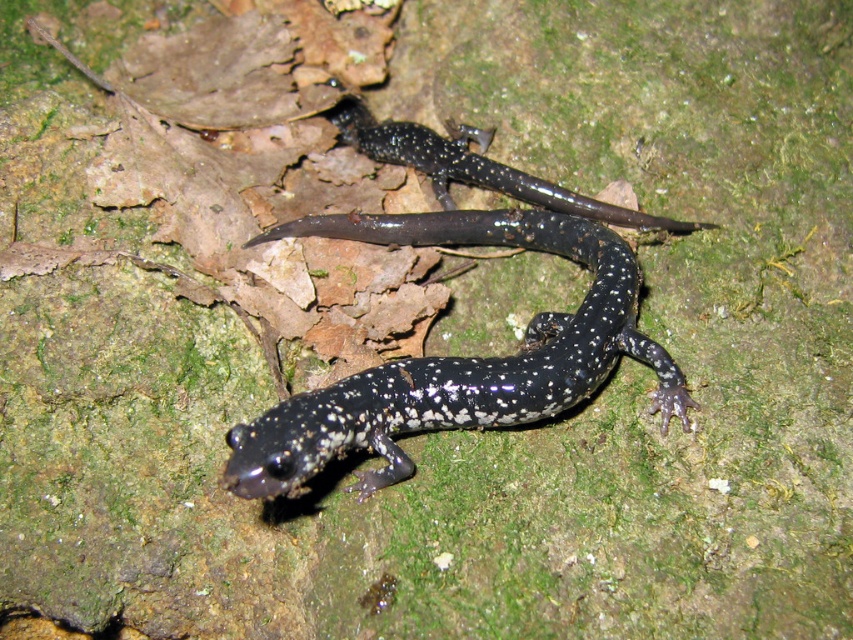
Question: Is shiny black salamander at center behind speckled glossy salamander at center?

Choices:
 (A) yes
 (B) no

Answer: (B)

Question: Can you confirm if shiny black salamander at center is smaller than speckled glossy salamander at center?

Choices:
 (A) no
 (B) yes

Answer: (A)

Question: Among these points, which one is farthest from the camera?

Choices:
 (A) (462, 385)
 (B) (592, 204)

Answer: (B)

Question: Does shiny black salamander at center appear over speckled glossy salamander at center?

Choices:
 (A) no
 (B) yes

Answer: (A)

Question: Among these points, which one is farthest from the camera?

Choices:
 (A) (683, 410)
 (B) (560, 211)

Answer: (B)